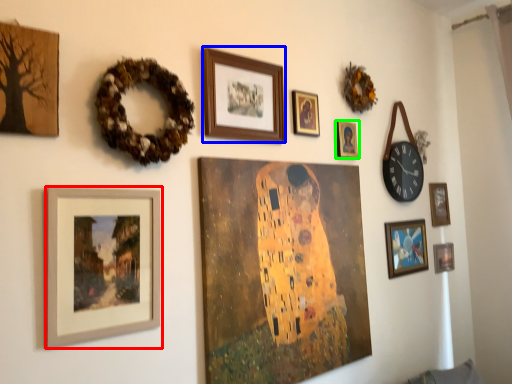
Question: Considering the real-world distances, which object is closest to picture frame (highlighted by a red box)? picture frame (highlighted by a blue box) or picture frame (highlighted by a green box).

Choices:
 (A) picture frame
 (B) picture frame

Answer: (A)